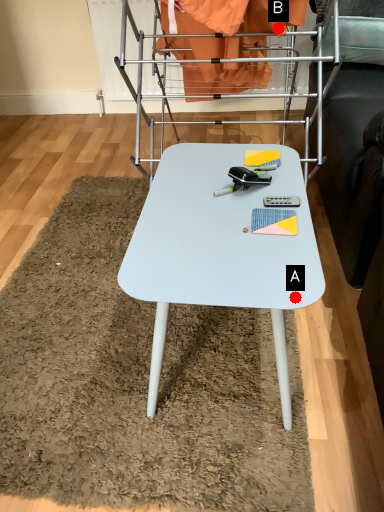
Question: Two points are circled on the image, labeled by A and B beside each circle. Which point is closer to the camera taking this photo?

Choices:
 (A) A is closer
 (B) B is closer

Answer: (A)